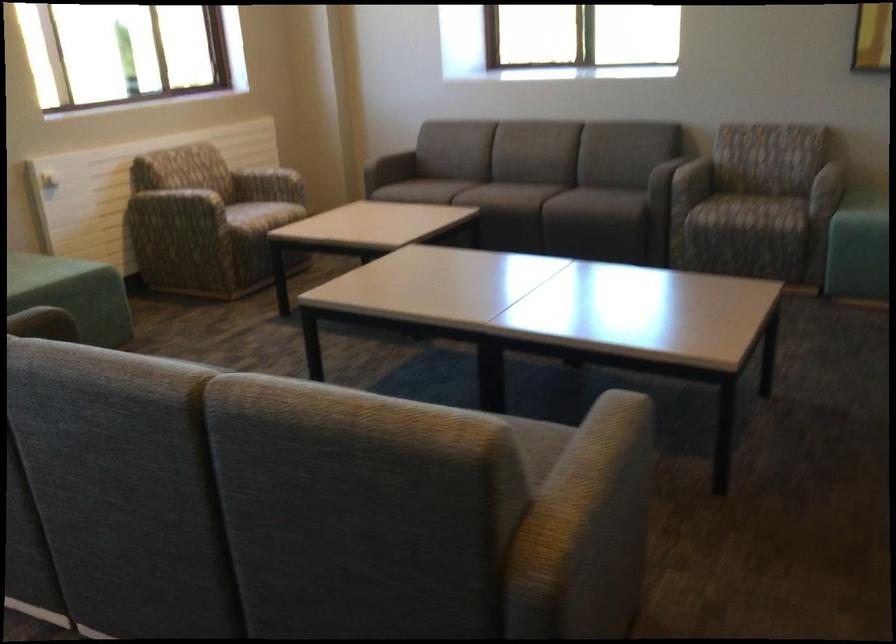
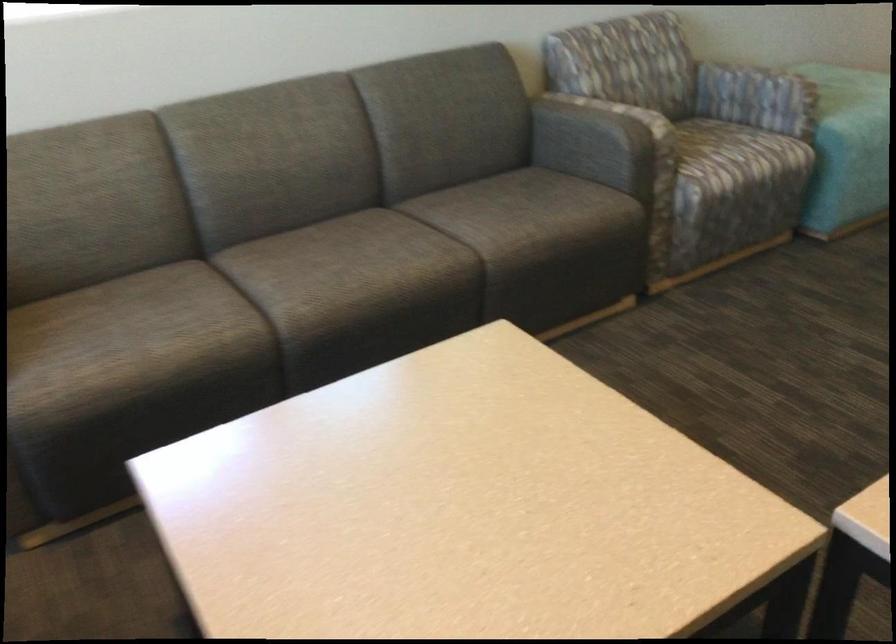
Locate, in the second image, the point that corresponds to the point at 630,169 in the first image.

(597, 140)